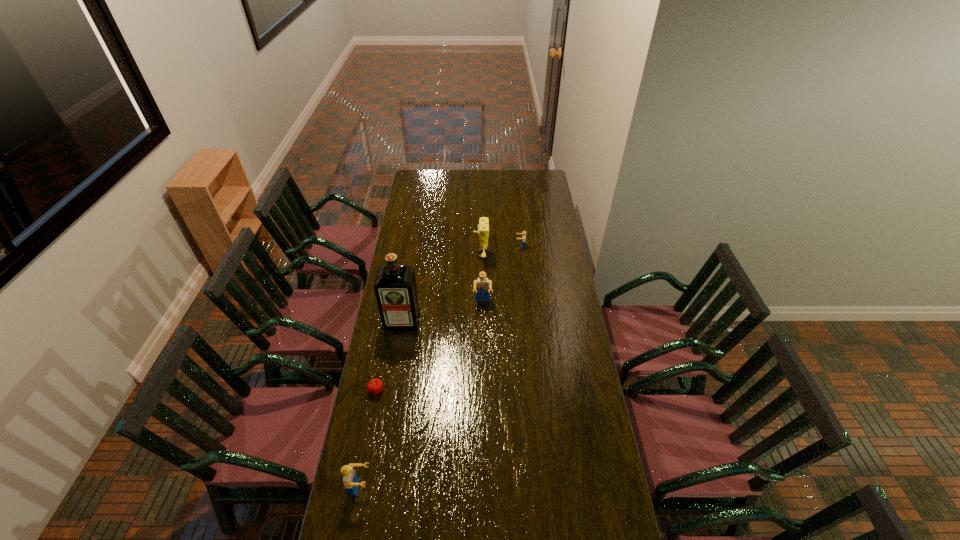
Identify the location of the second shortest Lego. (351, 481).

Locate an element on the screen. Image resolution: width=960 pixels, height=540 pixels. the nearest Lego is located at coordinates (x=351, y=481).

Identify the location of the third farthest object. This screenshot has width=960, height=540. (482, 285).

This screenshot has width=960, height=540. Find the location of `the second nearest Lego`. the second nearest Lego is located at coordinates (482, 285).

Where is `the rightmost Lego`? The width and height of the screenshot is (960, 540). the rightmost Lego is located at coordinates pos(523,233).

The image size is (960, 540). I want to click on the farthest Lego, so click(523, 233).

This screenshot has width=960, height=540. I want to click on the fifth shortest object, so click(x=483, y=228).

Find the location of a particular element. the tallest object is located at coordinates (395, 287).

Where is `the third nearest object`? Image resolution: width=960 pixels, height=540 pixels. the third nearest object is located at coordinates (395, 287).

Find the location of a particular element. This screenshot has height=540, width=960. the second nearest object is located at coordinates (375, 386).